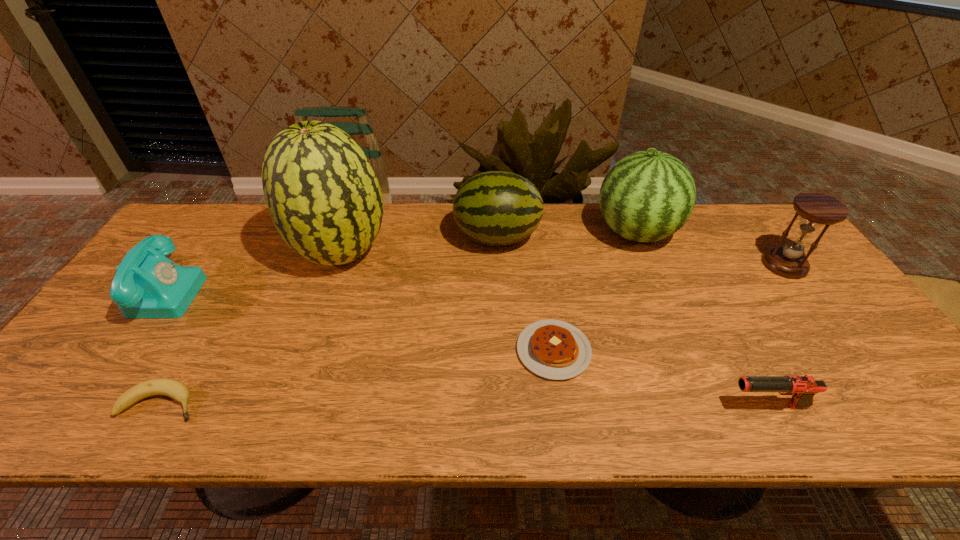
In order to click on blank area at the far left corner in this screenshot , I will do `click(195, 216)`.

Where is `vacant area that lies between the fifth tallest object and the rightmost object`? vacant area that lies between the fifth tallest object and the rightmost object is located at coordinates tap(474, 278).

Identify the location of free spot between the rightmost object and the banana. coord(472,334).

The height and width of the screenshot is (540, 960). Find the location of `free space between the second watermelon from left to right and the banana`. free space between the second watermelon from left to right and the banana is located at coordinates (329, 320).

Locate an element on the screen. free spot between the sixth tallest object and the hourglass is located at coordinates (776, 335).

This screenshot has height=540, width=960. I want to click on free space between the banana and the rightmost watermelon, so click(x=398, y=318).

This screenshot has width=960, height=540. I want to click on empty location between the second watermelon from left to right and the second tallest watermelon, so click(566, 235).

The image size is (960, 540). Find the location of `vacant region between the third object from left to right and the shortest watermelon`. vacant region between the third object from left to right and the shortest watermelon is located at coordinates (420, 245).

Identify the location of free spot between the fifth tallest object and the banana. This screenshot has width=960, height=540. (162, 347).

In order to click on empty space between the rightmost object and the tallest object in this screenshot , I will do `click(563, 259)`.